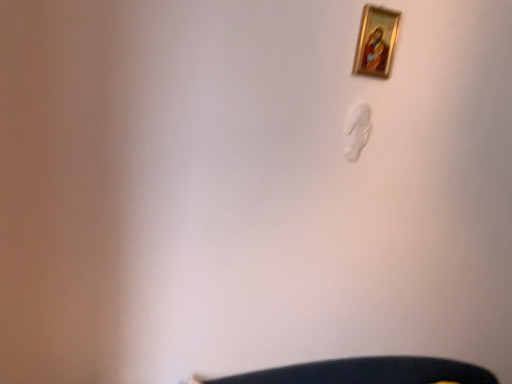
This screenshot has height=384, width=512. What do you see at coordinates (376, 42) in the screenshot?
I see `gold-framed painting at upper right` at bounding box center [376, 42].

Measure the distance between gold-framed painting at upper right and camera.

The distance of gold-framed painting at upper right from camera is 3.77 feet.

At what (x,y) coordinates should I click in order to perform the action: click on gold-framed painting at upper right. Please return your answer as a coordinate pair (x, y). This screenshot has height=384, width=512. Looking at the image, I should click on tap(376, 42).

I want to click on gold-framed painting at upper right, so click(376, 42).